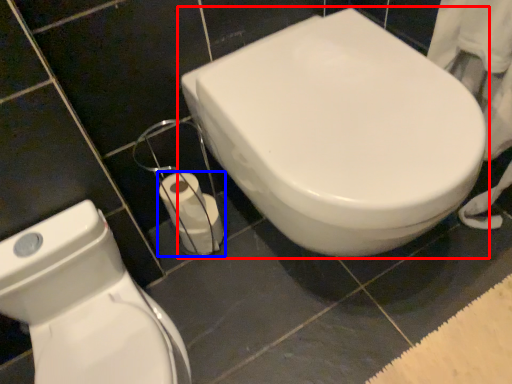
Question: Which of the following is the closest to the observer, toilet (highlighted by a red box) or toilet paper (highlighted by a blue box)?

Choices:
 (A) toilet
 (B) toilet paper

Answer: (A)